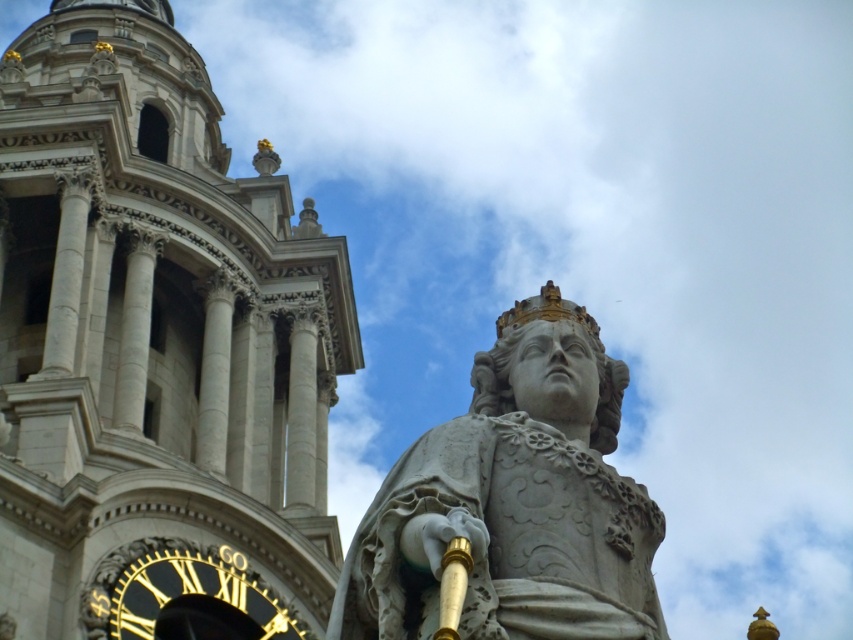
You are standing in front of the classical building and want to take a photo of the white stone statue at center without the white stone tower at upper center blocking the view. Is this possible given their positions?

The white stone statue at center is behind the white stone tower at upper center, so it would be blocked by the tower. Therefore, you cannot take a photo of the white stone statue at center without the tower blocking the view.